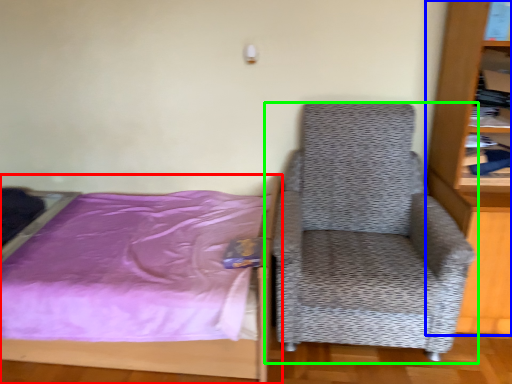
Question: Based on their relative distances, which object is farther from bed (highlighted by a red box)? Choose from bookcase (highlighted by a blue box) and chair (highlighted by a green box).

Choices:
 (A) bookcase
 (B) chair

Answer: (A)